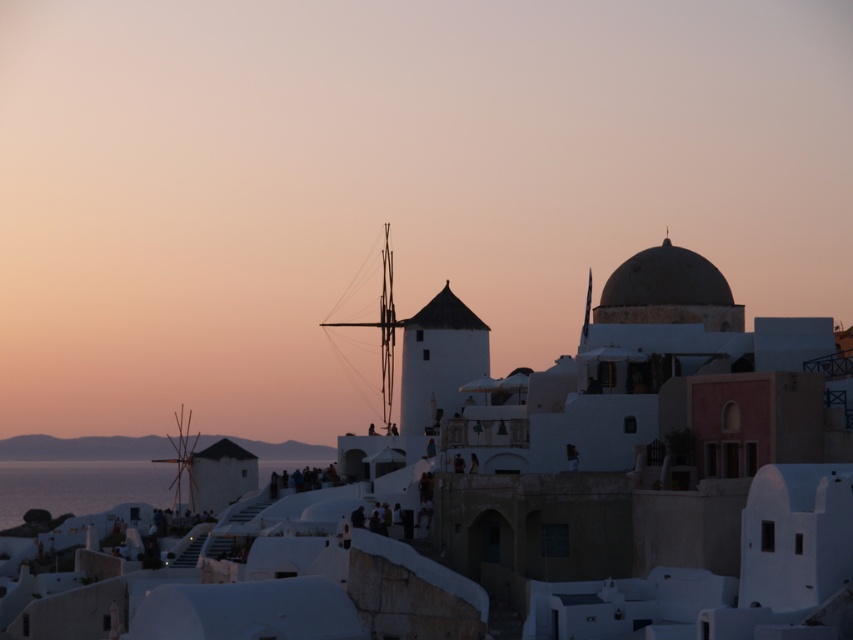
You are a tourist standing in the coastal town and want to take a photo of the white matte building at center and the white matte windmill at center. Which one appears closer to you in the photo?

The white matte building at center appears closer because it is positioned over the white matte windmill at center, indicating it is in front of the windmill.